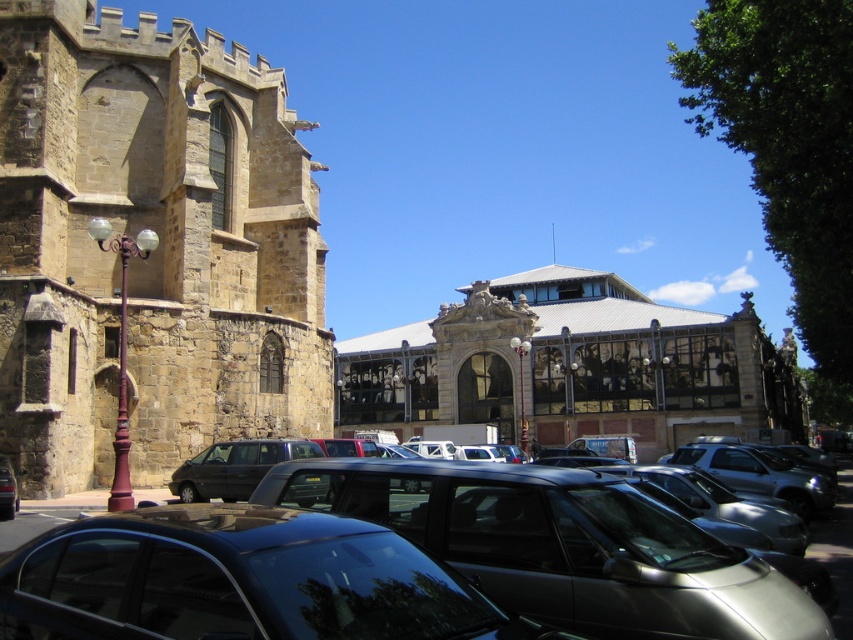
Does stone glass building at center have a lesser height compared to shiny black sedan at lower left?

Incorrect, stone glass building at center's height does not fall short of shiny black sedan at lower left's.

Based on the photo, how much distance is there between stone glass building at center and shiny black sedan at lower left?

stone glass building at center and shiny black sedan at lower left are 325.36 feet apart.

Where is `stone glass building at center`? Image resolution: width=853 pixels, height=640 pixels. stone glass building at center is located at coordinates (572, 365).

You are a GUI agent. You are given a task and a screenshot of the screen. Output one action in this format:
    pyautogui.click(x=<x>, y=<y>)
    Task: Click on the stone glass building at center
    The width and height of the screenshot is (853, 640).
    Given the screenshot: What is the action you would take?
    pyautogui.click(x=572, y=365)

Can you confirm if brown stone church at left is positioned to the right of glossy black car at lower center?

Incorrect, brown stone church at left is not on the right side of glossy black car at lower center.

Which of these two, brown stone church at left or glossy black car at lower center, stands taller?

brown stone church at left is taller.

Which is behind, point (202, 378) or point (277, 627)?

Positioned behind is point (202, 378).

Where is `brown stone church at left`? This screenshot has width=853, height=640. brown stone church at left is located at coordinates (152, 250).

Is stone glass building at center closer to camera compared to metallic cars at lower center?

No, it is not.

Where is `stone glass building at center`? The height and width of the screenshot is (640, 853). stone glass building at center is located at coordinates (572, 365).